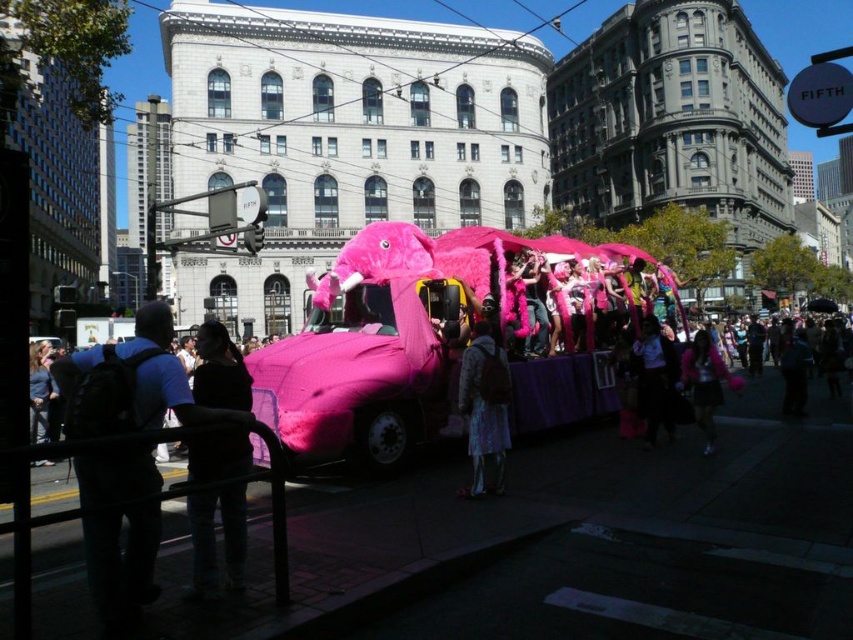
Question: Which point is closer to the camera?

Choices:
 (A) fuzzy pink elephant at center
 (B) white matte jacket at center

Answer: (A)

Question: Considering the real-world distances, which object is closest to the black fabric at lower left?

Choices:
 (A) fuzzy pink elephant at center
 (B) fluffy pink coat at center
 (C) pink fluffy jacket at lower right

Answer: (A)

Question: Can you confirm if white matte jacket at center is wider than pink fluffy jacket at lower right?

Choices:
 (A) yes
 (B) no

Answer: (B)

Question: Is black fabric at lower left above fluffy pink coat at center?

Choices:
 (A) no
 (B) yes

Answer: (B)

Question: Can you confirm if dark blue backpack at left is positioned above black fabric at lower left?

Choices:
 (A) yes
 (B) no

Answer: (A)

Question: Which object is positioned closest to the white matte jacket at center?

Choices:
 (A) black fabric at lower left
 (B) fuzzy pink elephant at center
 (C) dark blue backpack at left

Answer: (B)